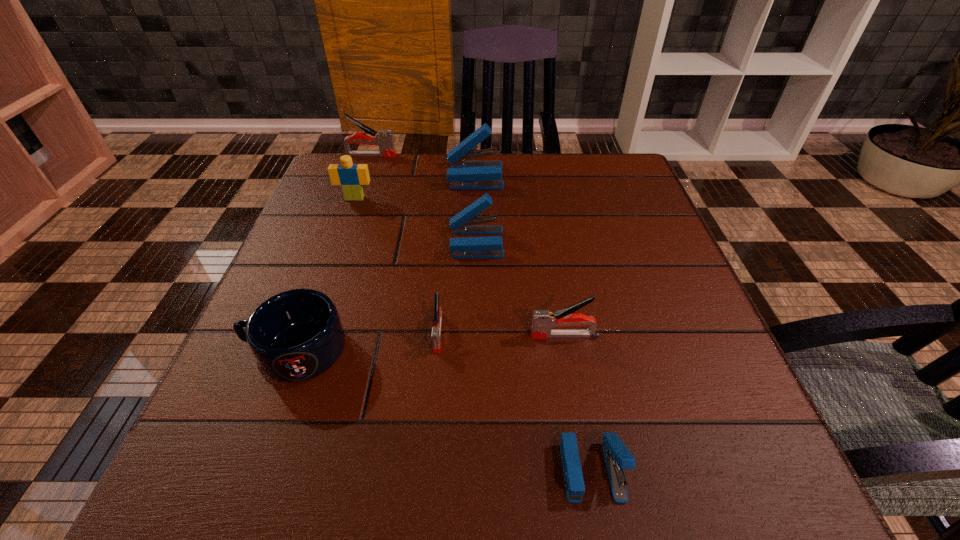
Find the location of a particular element. The image size is (960, 540). the biggest gray stapler is located at coordinates (384, 139).

Where is `the farthest gray stapler`? The width and height of the screenshot is (960, 540). the farthest gray stapler is located at coordinates (384, 139).

Identify the location of the farthest blue stapler. This screenshot has width=960, height=540. (464, 175).

Identify the location of the biggest blue stapler. This screenshot has height=540, width=960. (464, 175).

The image size is (960, 540). Find the location of `the third farthest object`. the third farthest object is located at coordinates (351, 177).

Identify the location of beige Lego. Image resolution: width=960 pixels, height=540 pixels. pos(351,177).

Locate an element on the screen. This screenshot has width=960, height=540. the rightmost gray stapler is located at coordinates (543, 321).

The width and height of the screenshot is (960, 540). What are the coordinates of `the third farthest stapler` in the screenshot? It's located at (464, 222).

Locate an element on the screen. The width and height of the screenshot is (960, 540). the fourth farthest object is located at coordinates (464, 222).

Locate an element on the screen. The height and width of the screenshot is (540, 960). blue mug is located at coordinates [x=296, y=335].